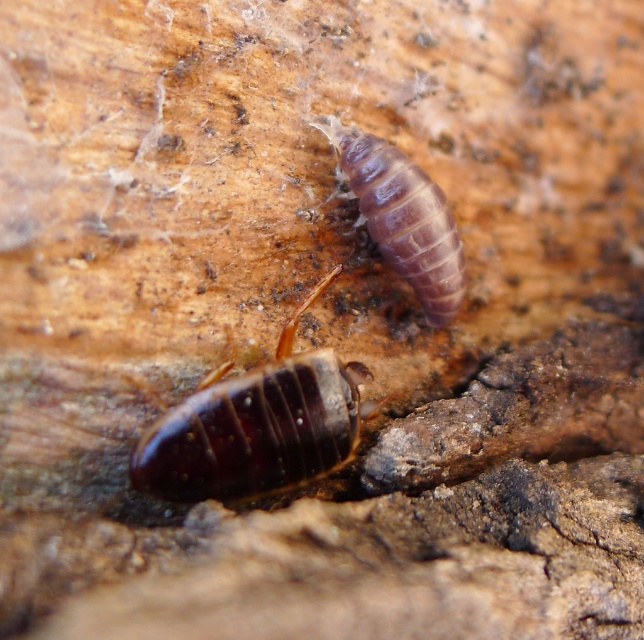
Question: Considering the relative positions of shiny dark brown beetle at center and purple matte worm at upper center in the image provided, where is shiny dark brown beetle at center located with respect to purple matte worm at upper center?

Choices:
 (A) above
 (B) below

Answer: (B)

Question: Does shiny dark brown beetle at center have a larger size compared to purple matte worm at upper center?

Choices:
 (A) yes
 (B) no

Answer: (A)

Question: Among these points, which one is nearest to the camera?

Choices:
 (A) (276, 428)
 (B) (386, 220)

Answer: (A)

Question: Which object appears farthest from the camera in this image?

Choices:
 (A) purple matte worm at upper center
 (B) shiny dark brown beetle at center

Answer: (A)

Question: Does shiny dark brown beetle at center lie behind purple matte worm at upper center?

Choices:
 (A) no
 (B) yes

Answer: (A)